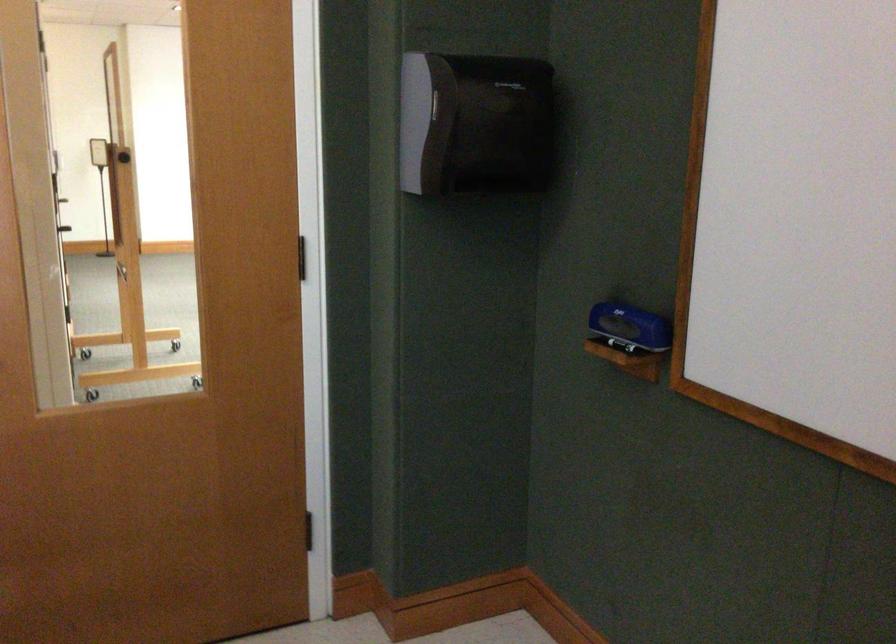
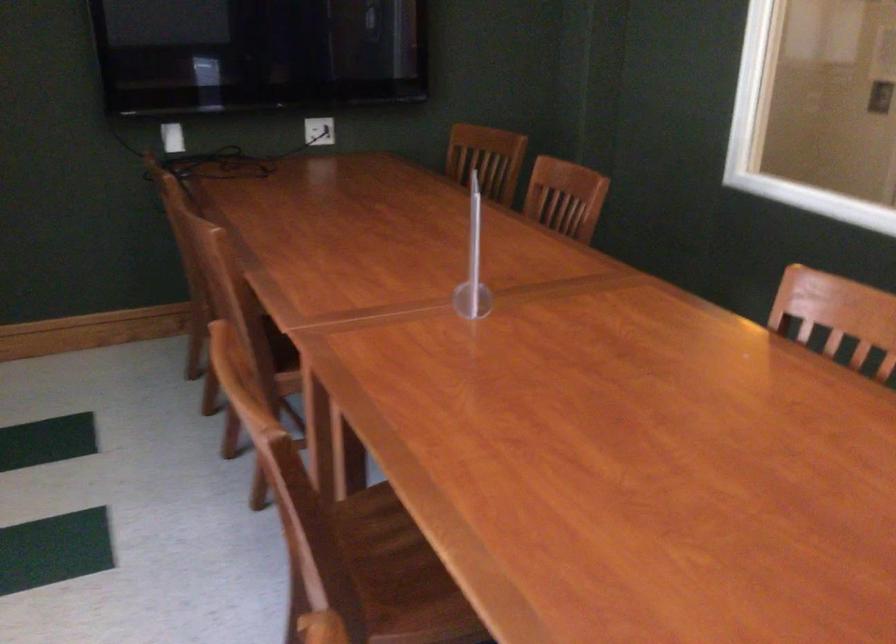
Consider the image. First-person continuous shooting, in which direction is the camera rotating?

The rotation direction of the camera is left-down.